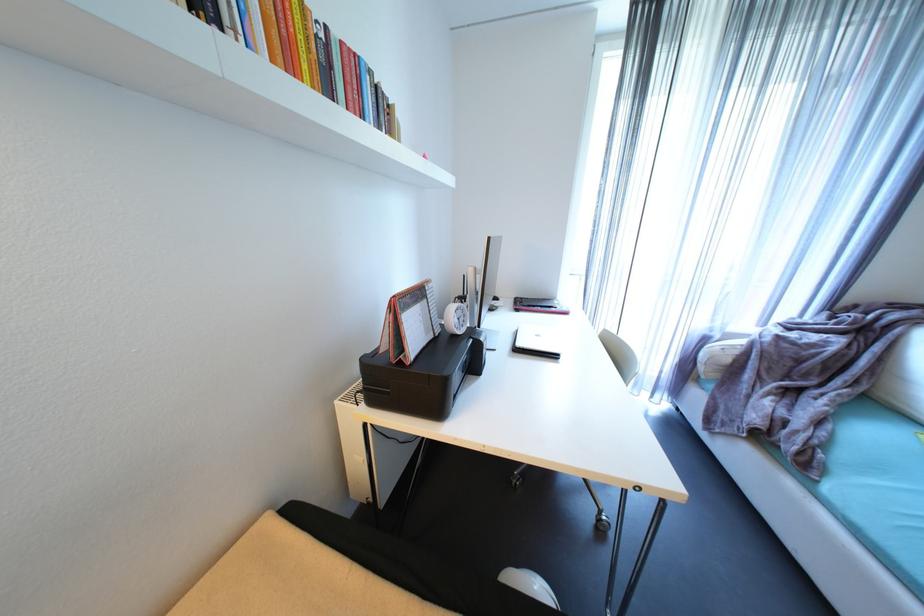
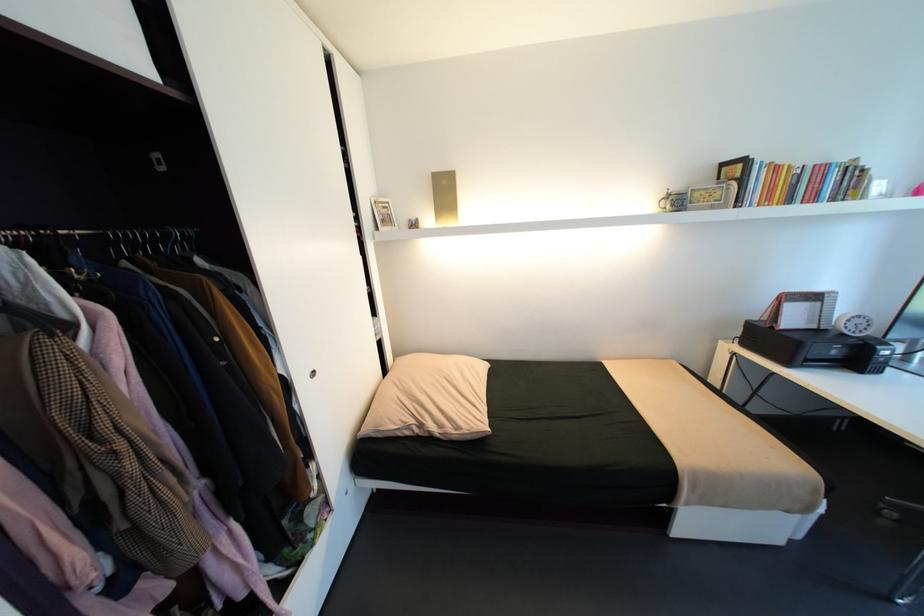
In the second image, find the point that corresponds to (407,363) in the first image.

(779, 328)